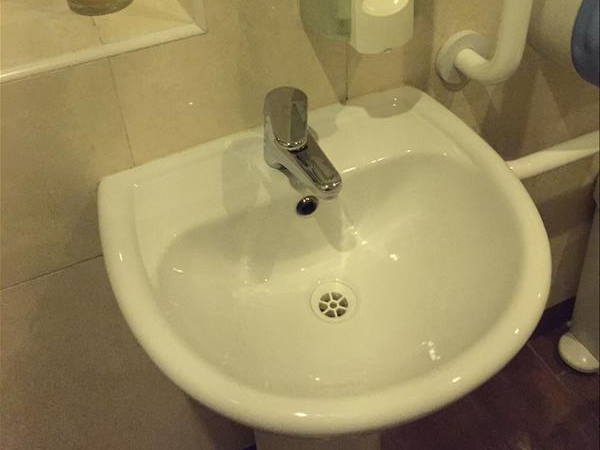
Locate an element on the screen. The image size is (600, 450). sink is located at coordinates (426, 249).